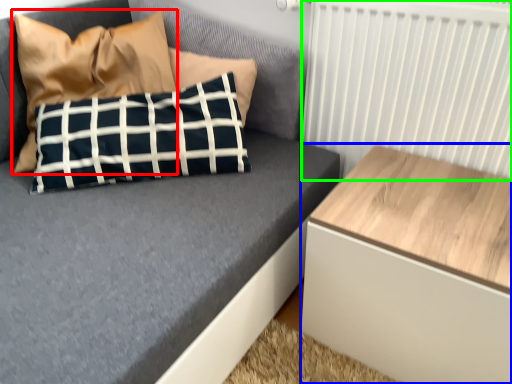
Question: Considering the real-world distances, which object is farthest from pillow (highlighted by a red box)? table (highlighted by a blue box) or radiator (highlighted by a green box)?

Choices:
 (A) table
 (B) radiator

Answer: (A)